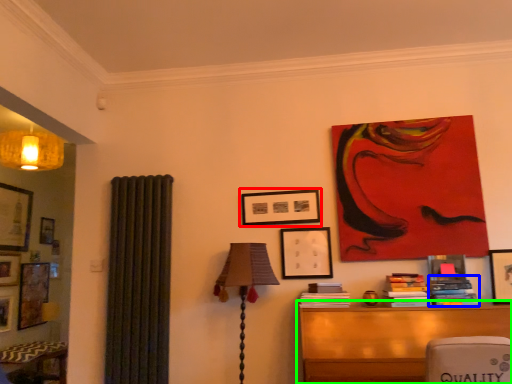
Question: Based on their relative distances, which object is nearer to picture frame (highlighted by a red box)? Choose from book (highlighted by a blue box) and table (highlighted by a green box).

Choices:
 (A) book
 (B) table

Answer: (B)